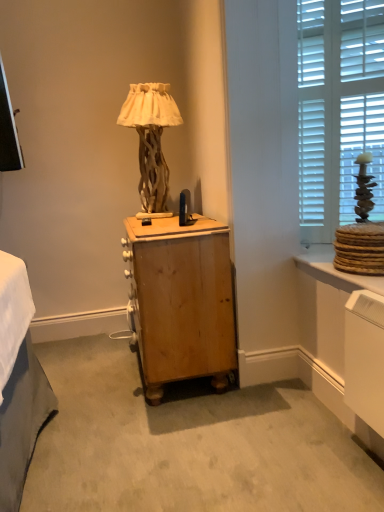
Question: From a real-world perspective, is wooden nightstand at center physically above wooden textured lamp at center?

Choices:
 (A) no
 (B) yes

Answer: (A)

Question: Is wooden nightstand at center to the right of wooden textured lamp at center from the viewer's perspective?

Choices:
 (A) no
 (B) yes

Answer: (B)

Question: Does wooden nightstand at center turn towards wooden textured lamp at center?

Choices:
 (A) yes
 (B) no

Answer: (B)

Question: Is wooden textured lamp at center completely or partially inside wooden nightstand at center?

Choices:
 (A) no
 (B) yes

Answer: (A)

Question: Is wooden nightstand at center to the left of wooden textured lamp at center from the viewer's perspective?

Choices:
 (A) yes
 (B) no

Answer: (B)

Question: From the image's perspective, would you say wooden nightstand at center is positioned over wooden textured lamp at center?

Choices:
 (A) yes
 (B) no

Answer: (B)

Question: Is white wood blinds at upper right at the right side of matte wood vanity at lower right?

Choices:
 (A) yes
 (B) no

Answer: (A)

Question: Does white wood blinds at upper right have a larger size compared to matte wood vanity at lower right?

Choices:
 (A) no
 (B) yes

Answer: (B)

Question: From the image's perspective, is white wood blinds at upper right under matte wood vanity at lower right?

Choices:
 (A) no
 (B) yes

Answer: (A)

Question: Is white wood blinds at upper right not near matte wood vanity at lower right?

Choices:
 (A) no
 (B) yes

Answer: (A)

Question: Is white wood blinds at upper right behind matte wood vanity at lower right?

Choices:
 (A) yes
 (B) no

Answer: (A)

Question: From a real-world perspective, is white wood blinds at upper right under matte wood vanity at lower right?

Choices:
 (A) yes
 (B) no

Answer: (B)

Question: Can you confirm if matte wood vanity at lower right is taller than wooden nightstand at center?

Choices:
 (A) yes
 (B) no

Answer: (B)